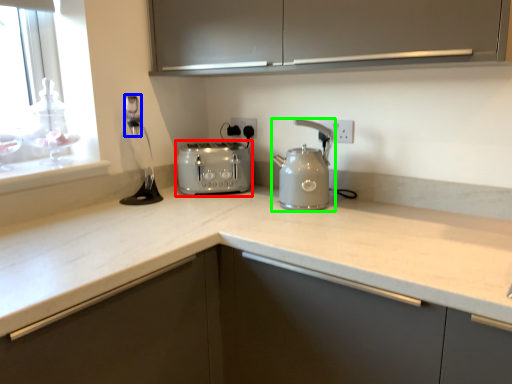
Question: Which object is positioned farthest from toaster (highlighted by a red box)? Select from faucet (highlighted by a blue box) and kitchen appliance (highlighted by a green box).

Choices:
 (A) faucet
 (B) kitchen appliance

Answer: (A)